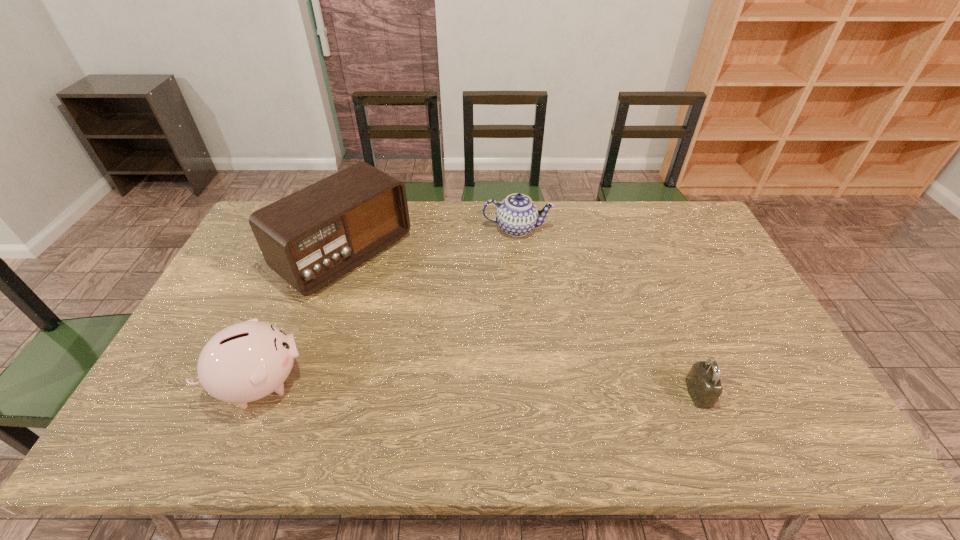
Find the location of `free space that is in between the radio receiver and the piggy bank`. free space that is in between the radio receiver and the piggy bank is located at coordinates (302, 319).

Locate an element on the screen. vacant area that lies between the third tallest object and the rightmost object is located at coordinates (608, 311).

The image size is (960, 540). Find the location of `vacant space that is in between the radio receiver and the shortest object`. vacant space that is in between the radio receiver and the shortest object is located at coordinates (522, 323).

Locate an element on the screen. vacant area between the radio receiver and the third shortest object is located at coordinates (302, 319).

This screenshot has width=960, height=540. I want to click on free area in between the tallest object and the third object from left to right, so click(431, 242).

This screenshot has width=960, height=540. In order to click on free space that is in between the third tallest object and the radio receiver in this screenshot , I will do `click(431, 242)`.

I want to click on vacant space in between the radio receiver and the padlock, so click(522, 323).

This screenshot has width=960, height=540. Identify the location of free spot between the shortest object and the second shortest object. (608, 311).

The width and height of the screenshot is (960, 540). In order to click on object that is the closest to the padlock in this screenshot , I will do `click(517, 215)`.

This screenshot has width=960, height=540. Identify the location of object that can be found as the second closest to the shortest object. (310, 238).